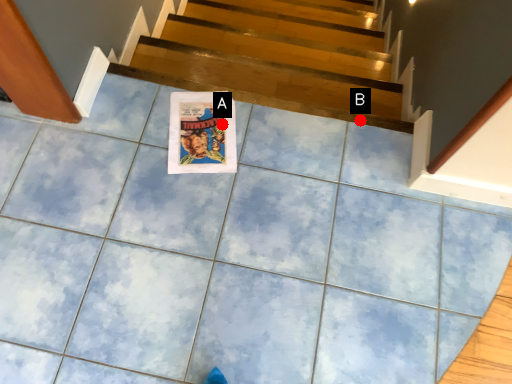
Question: Two points are circled on the image, labeled by A and B beside each circle. Which of the following is the farthest from the observer?

Choices:
 (A) A is further
 (B) B is further

Answer: (B)